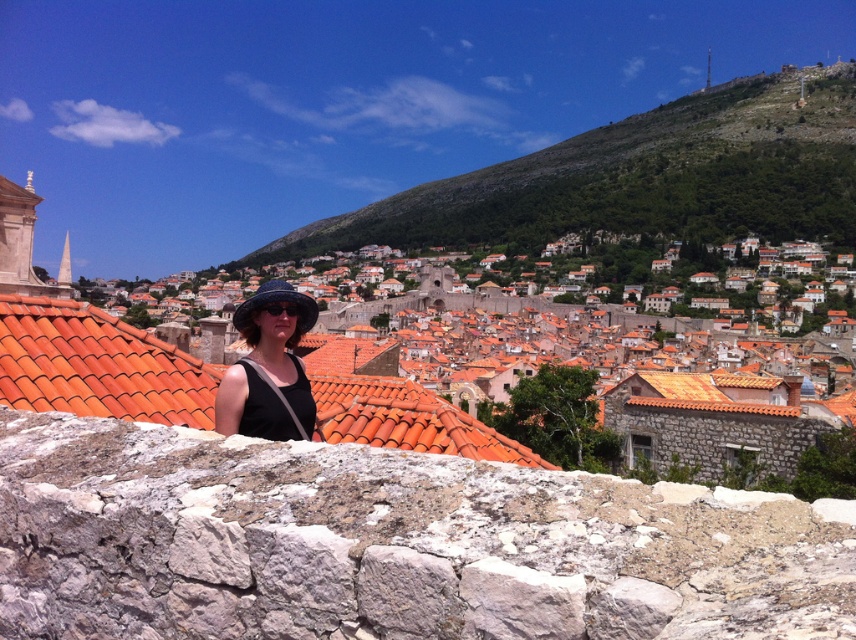
Is green grassy hillside at upper center to the right of blue fabric hat at center from the viewer's perspective?

Yes, green grassy hillside at upper center is to the right of blue fabric hat at center.

Which is in front, point (840, 138) or point (266, 300)?

Point (266, 300)

This screenshot has height=640, width=856. What are the coordinates of `green grassy hillside at upper center` in the screenshot? It's located at (639, 179).

Who is more forward, [759,225] or [301,294]?

Point [301,294] is in front.

Where is `green grassy hillside at upper center`? green grassy hillside at upper center is located at coordinates (639, 179).

How distant is green grassy hillside at upper center from orange clay tiles at center?

They are 283.31 meters apart.

Who is lower down, green grassy hillside at upper center or orange clay tiles at center?

Positioned lower is orange clay tiles at center.

Identify the location of green grassy hillside at upper center. (639, 179).